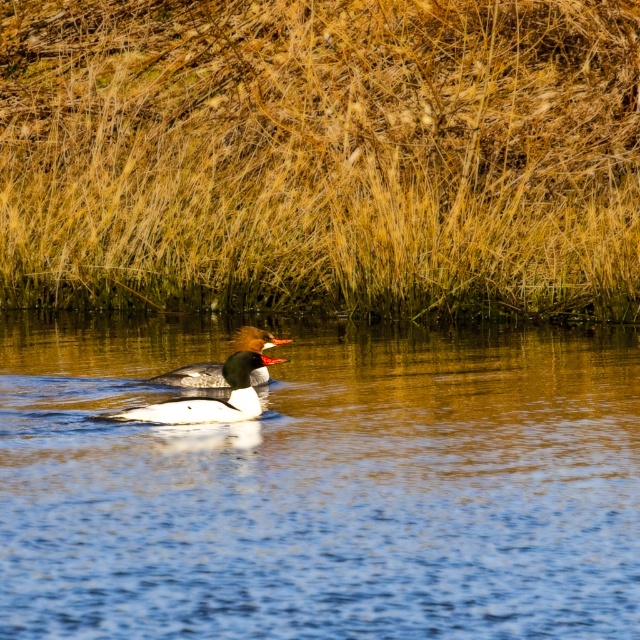
You are a photographer aiming to capture the white glossy duck at center and its reflection on the blue smooth water at center. Based on the scene, can you confirm if the duck is positioned above the water where its reflection would naturally appear?

The blue smooth water at center is below the white glossy duck at center, so yes, the duck is positioned above the water, and its reflection would naturally appear on the water surface.

You are a wildlife photographer aiming to capture the ducks in the image. Which duck, the white glossy duck at center or the shiny brown duck at center, would you need to adjust your camera focus for if you want to focus on the one closer to you?

The white glossy duck at center is shorter than the shiny brown duck at center, so it is closer to the viewer. Therefore, you should adjust your camera focus to the white glossy duck at center to capture it clearly.